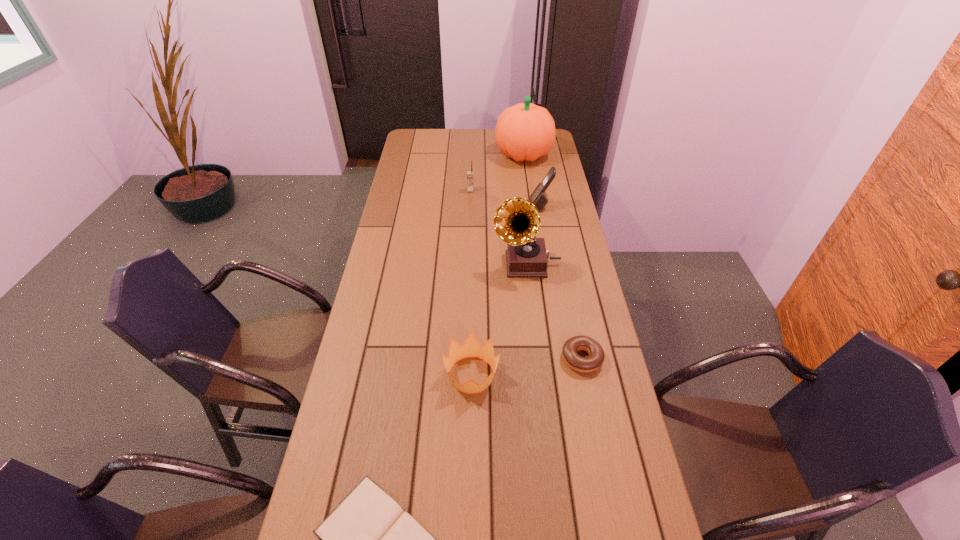
This screenshot has width=960, height=540. Find the location of `the farthest object`. the farthest object is located at coordinates (524, 132).

The width and height of the screenshot is (960, 540). Find the location of `the fourth nearest object`. the fourth nearest object is located at coordinates (x=517, y=221).

The width and height of the screenshot is (960, 540). Identify the location of the nearer cellular telephone. (539, 198).

Identify the location of the right cellular telephone. This screenshot has width=960, height=540. (539, 198).

The image size is (960, 540). What are the coordinates of `the fourth shortest object` in the screenshot? It's located at (469, 173).

You are a GUI agent. You are given a task and a screenshot of the screen. Output one action in this format:
    pyautogui.click(x=<x>, y=<y>)
    Task: Click on the second farthest object
    The width and height of the screenshot is (960, 540).
    Given the screenshot: What is the action you would take?
    pyautogui.click(x=469, y=173)

Locate an element on the screen. The height and width of the screenshot is (540, 960). the fifth tallest object is located at coordinates (471, 348).

Where is `the second shortest object`? the second shortest object is located at coordinates (596, 356).

At what (x,y) coordinates should I click in order to perform the action: click on vacant space located on the front of the pumpkin. Please return your answer as a coordinate pair (x, y). The image size is (960, 540). Looking at the image, I should click on (529, 194).

What are the coordinates of `free space located 0.320m from the horn of the phonograph record` in the screenshot? It's located at (403, 264).